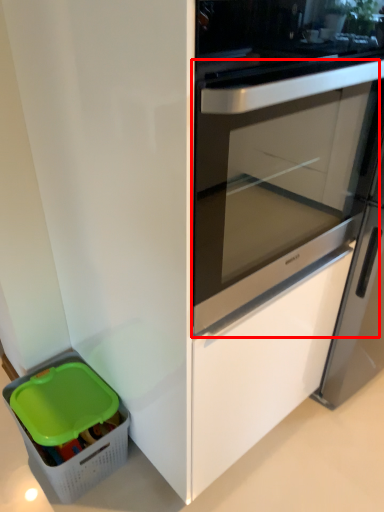
Question: Observing the image, what is the correct spatial positioning of screen door (annotated by the red box) in reference to storage box?

Choices:
 (A) right
 (B) left

Answer: (A)